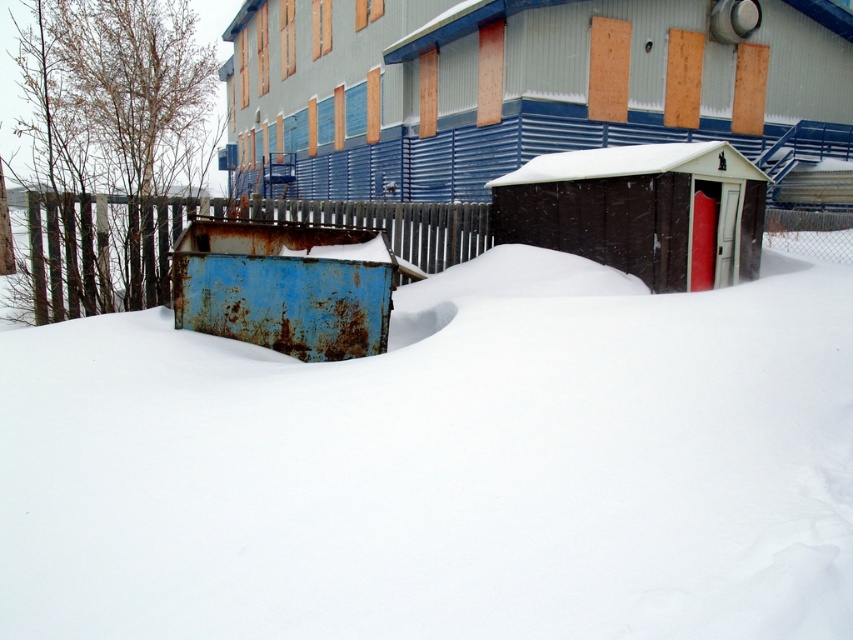
Measure the distance between brown wooden shed at upper center and brown plastic shed at center-right.

9.00 meters

Is brown wooden shed at upper center taller than brown plastic shed at center-right?

Yes.

At what (x,y) coordinates should I click in order to perform the action: click on brown wooden shed at upper center. Please return your answer as a coordinate pair (x, y). Looking at the image, I should click on (532, 88).

Between point (599, 102) and point (143, 205), which one is positioned in front?

Positioned in front is point (143, 205).

The height and width of the screenshot is (640, 853). Describe the element at coordinates (532, 88) in the screenshot. I see `brown wooden shed at upper center` at that location.

Does point (416, 182) come behind point (405, 220)?

Yes.

Find the location of a particular element. This screenshot has height=640, width=853. brown wooden shed at upper center is located at coordinates (532, 88).

Is brown plastic shed at center-right further to camera compared to rusty metal fence at center?

Yes.

Who is more forward, (614, 154) or (425, 240)?

Positioned in front is point (614, 154).

Does point (566, 232) lie behind point (380, 205)?

No, (566, 232) is closer to viewer.

Locate an element on the screen. The width and height of the screenshot is (853, 640). brown plastic shed at center-right is located at coordinates (641, 211).